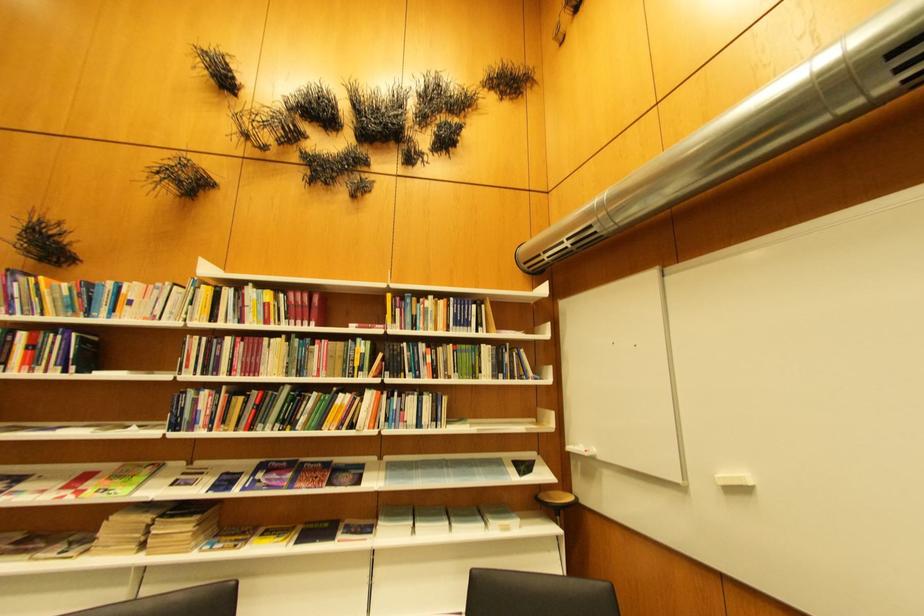
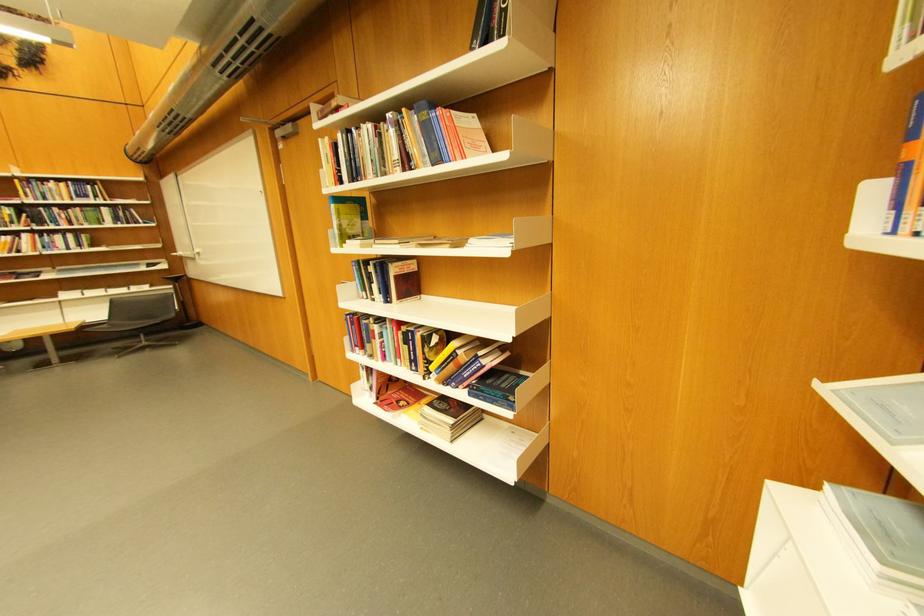
Locate, in the second image, the point that corresponds to [611,460] in the first image.

(195, 257)